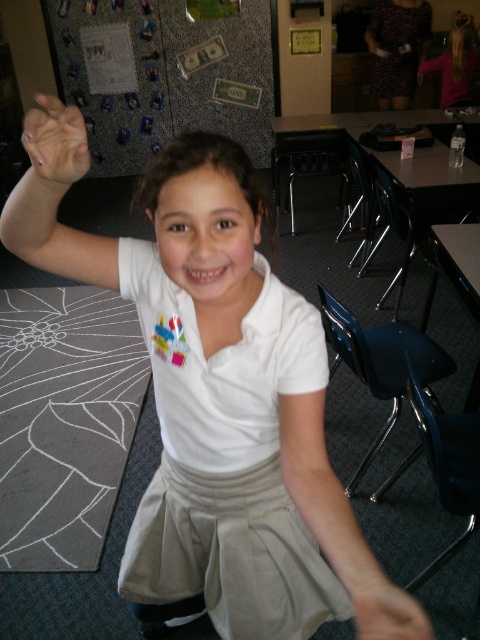
Between white chalk drawing at lower left and white fabric arm at lower center, which one appears on the right side from the viewer's perspective?

From the viewer's perspective, white fabric arm at lower center appears more on the right side.

Can you confirm if white chalk drawing at lower left is positioned above white fabric arm at lower center?

No.

Between point (36, 294) and point (348, 560), which one is positioned behind?

The point (36, 294) is more distant.

Where is `white chalk drawing at lower left`? Image resolution: width=480 pixels, height=640 pixels. white chalk drawing at lower left is located at coordinates (64, 420).

Does white fabric arm at lower center have a smaller size compared to matte white arm at upper left?

Indeed, white fabric arm at lower center has a smaller size compared to matte white arm at upper left.

Based on the photo, can you confirm if white fabric arm at lower center is positioned above matte white arm at upper left?

No, white fabric arm at lower center is not above matte white arm at upper left.

Describe the element at coordinates (340, 525) in the screenshot. I see `white fabric arm at lower center` at that location.

Where is `white fabric arm at lower center`? The height and width of the screenshot is (640, 480). white fabric arm at lower center is located at coordinates (340, 525).

Which is more to the right, white fabric arm at lower center or printed fabric dress at upper right?

Positioned to the right is printed fabric dress at upper right.

Does white fabric arm at lower center appear on the right side of printed fabric dress at upper right?

No, white fabric arm at lower center is not to the right of printed fabric dress at upper right.

Between point (372, 612) and point (391, 4), which one is positioned behind?

Point (391, 4)

Locate an element on the screen. Image resolution: width=480 pixels, height=640 pixels. white fabric arm at lower center is located at coordinates (340, 525).